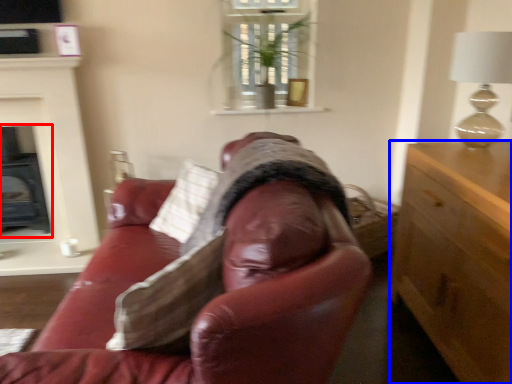
Question: Among these objects, which one is farthest to the camera, fireplace (highlighted by a red box) or cabinetry (highlighted by a blue box)?

Choices:
 (A) fireplace
 (B) cabinetry

Answer: (A)